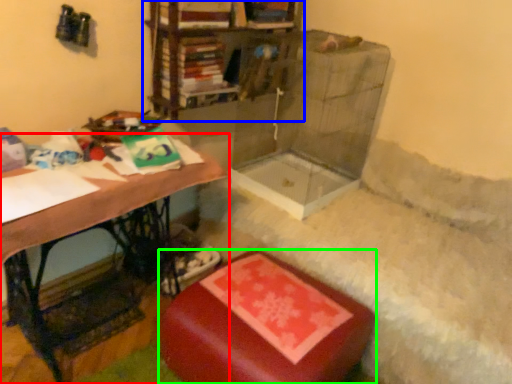
Question: Which is farther away from table (highlighted by a red box)? shelf (highlighted by a blue box) or furniture (highlighted by a green box)?

Choices:
 (A) shelf
 (B) furniture

Answer: (A)